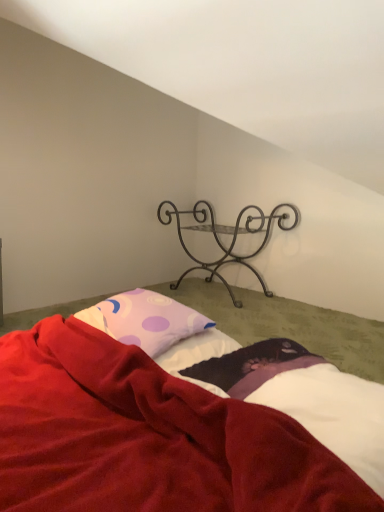
Question: Is the position of metallic wrought iron shelf at upper center less distant than that of purple dotted pillow at center?

Choices:
 (A) no
 (B) yes

Answer: (A)

Question: From a real-world perspective, is metallic wrought iron shelf at upper center beneath purple dotted pillow at center?

Choices:
 (A) no
 (B) yes

Answer: (B)

Question: Does metallic wrought iron shelf at upper center have a larger size compared to purple dotted pillow at center?

Choices:
 (A) no
 (B) yes

Answer: (B)

Question: Does metallic wrought iron shelf at upper center have a greater height compared to purple dotted pillow at center?

Choices:
 (A) no
 (B) yes

Answer: (B)

Question: Is the position of metallic wrought iron shelf at upper center more distant than that of purple dotted pillow at center?

Choices:
 (A) yes
 (B) no

Answer: (A)

Question: From a real-world perspective, is white soft sheet at lower right physically located above or below velvet red blanket at lower center?

Choices:
 (A) below
 (B) above

Answer: (B)

Question: In the image, is white soft sheet at lower right positioned in front of or behind velvet red blanket at lower center?

Choices:
 (A) front
 (B) behind

Answer: (B)

Question: Choose the correct answer: Is white soft sheet at lower right inside velvet red blanket at lower center or outside it?

Choices:
 (A) outside
 (B) inside

Answer: (B)

Question: Is white soft sheet at lower right taller or shorter than velvet red blanket at lower center?

Choices:
 (A) short
 (B) tall

Answer: (A)

Question: Considering the positions of velvet red blanket at lower center and metallic wrought iron shelf at upper center in the image, is velvet red blanket at lower center bigger or smaller than metallic wrought iron shelf at upper center?

Choices:
 (A) small
 (B) big

Answer: (B)

Question: Is point (195, 404) positioned closer to the camera than point (292, 204)?

Choices:
 (A) closer
 (B) farther

Answer: (A)

Question: In terms of height, does velvet red blanket at lower center look taller or shorter compared to metallic wrought iron shelf at upper center?

Choices:
 (A) tall
 (B) short

Answer: (B)

Question: From the image's perspective, relative to metallic wrought iron shelf at upper center, is velvet red blanket at lower center above or below?

Choices:
 (A) above
 (B) below

Answer: (B)

Question: Is purple dotted pillow at center inside or outside of white soft sheet at lower right?

Choices:
 (A) outside
 (B) inside

Answer: (A)

Question: Is purple dotted pillow at center bigger or smaller than white soft sheet at lower right?

Choices:
 (A) small
 (B) big

Answer: (B)